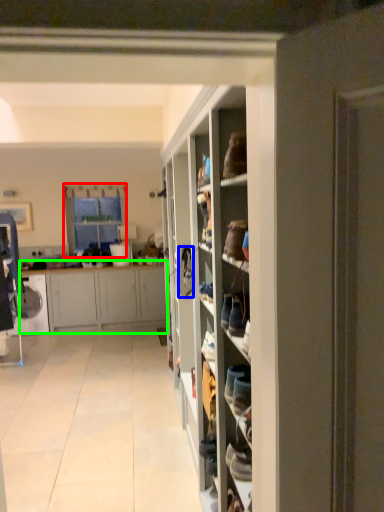
Question: Based on their relative distances, which object is farther from window (highlighted by a red box)? Choose from shoe (highlighted by a blue box) and cabinetry (highlighted by a green box).

Choices:
 (A) shoe
 (B) cabinetry

Answer: (A)